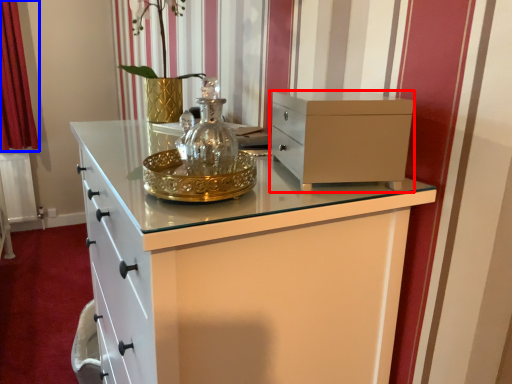
Question: Which point is further to the camera, chest of drawers (highlighted by a red box) or curtain (highlighted by a blue box)?

Choices:
 (A) chest of drawers
 (B) curtain

Answer: (B)